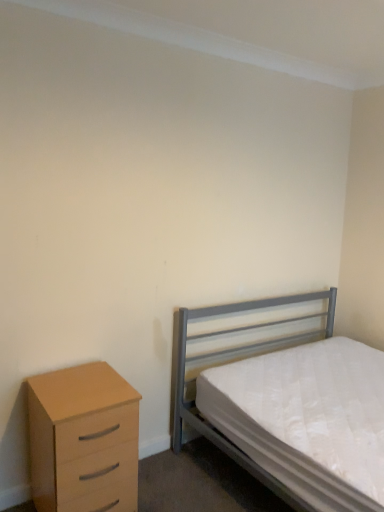
Question: Based on their positions, is light wood/veneer chest of drawers at left located to the left or right of metallic gray bed at right?

Choices:
 (A) right
 (B) left

Answer: (B)

Question: In terms of size, does light wood/veneer chest of drawers at left appear bigger or smaller than metallic gray bed at right?

Choices:
 (A) small
 (B) big

Answer: (A)

Question: Considering their positions, is light wood/veneer chest of drawers at left located in front of or behind metallic gray bed at right?

Choices:
 (A) behind
 (B) front

Answer: (A)

Question: Visually, is metallic gray bed at right positioned to the left or to the right of light wood/veneer chest of drawers at left?

Choices:
 (A) left
 (B) right

Answer: (B)

Question: In terms of height, does metallic gray bed at right look taller or shorter compared to light wood/veneer chest of drawers at left?

Choices:
 (A) tall
 (B) short

Answer: (A)

Question: From the image's perspective, is metallic gray bed at right positioned above or below light wood/veneer chest of drawers at left?

Choices:
 (A) below
 (B) above

Answer: (B)

Question: From a real-world perspective, is metallic gray bed at right positioned above or below light wood/veneer chest of drawers at left?

Choices:
 (A) below
 (B) above

Answer: (B)